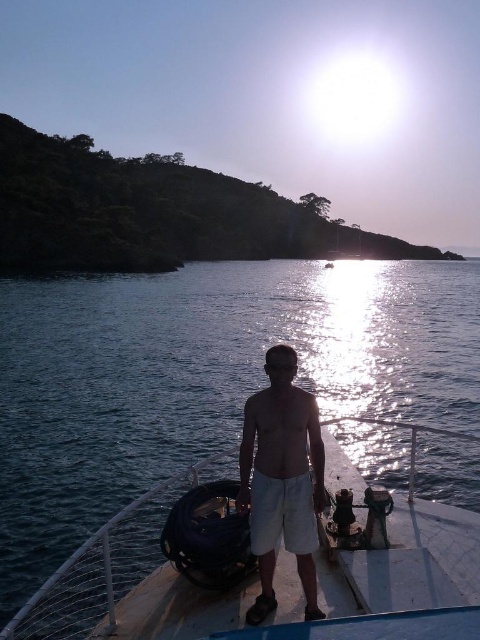
Looking at this image, you are a photographer trying to capture the scene with the blue water at center and the white cotton shorts at center. Based on their positions, which object should you focus on first to ensure both are in the frame?

The white cotton shorts at center should be focused on first because the blue water at center is located above it, ensuring both will be captured when centered on the shorts.

You are a photographer trying to capture the reflection of the sun on the water. Given the coordinates of the blue water at center, can you determine if the reflection is visible in the image?

The blue water at center is located at coordinates point [203,378], which is near the upper part of the image. Since the sun is positioned high in the sky, its reflection would likely be visible on the water surface at that location.

You are a photographer trying to capture the reflection of the sun on the water. You notice the blue water at center and the white cotton shorts at center in your viewfinder. Which object is wider in your current camera frame?

The blue water at center is wider than the white cotton shorts at center according to the description.